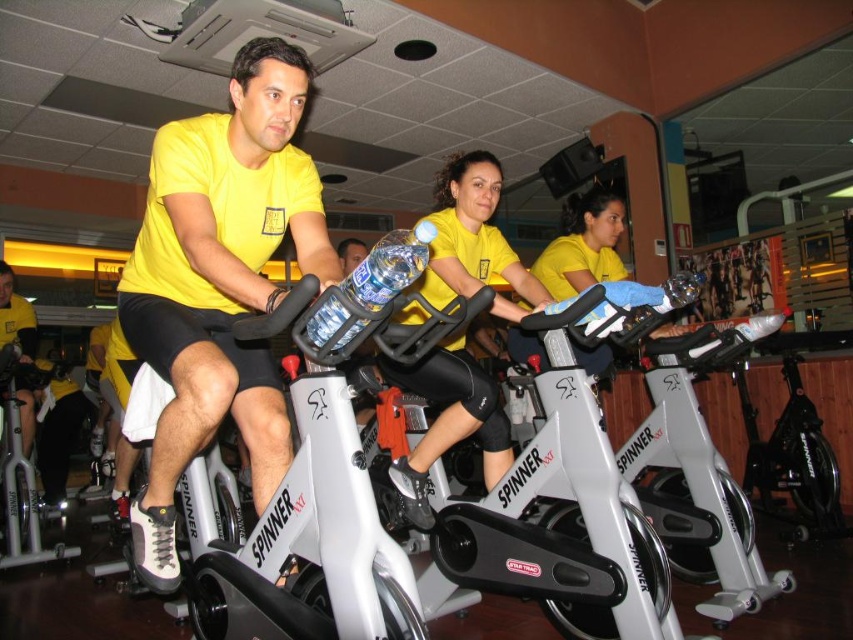
Question: Which of the following is the farthest from the observer?

Choices:
 (A) yellow matte jersey at center
 (B) matte yellow shirt at center

Answer: (A)

Question: Is matte yellow shirt at center above yellow matte jersey at center?

Choices:
 (A) no
 (B) yes

Answer: (A)

Question: Which object is closer to the camera taking this photo?

Choices:
 (A) yellow matte jersey at center
 (B) matte yellow shirt at center

Answer: (B)

Question: Does matte yellow shirt at center appear on the right side of yellow matte jersey at center?

Choices:
 (A) no
 (B) yes

Answer: (A)

Question: Can you confirm if matte yellow shirt at center is positioned to the right of yellow matte jersey at center?

Choices:
 (A) yes
 (B) no

Answer: (B)